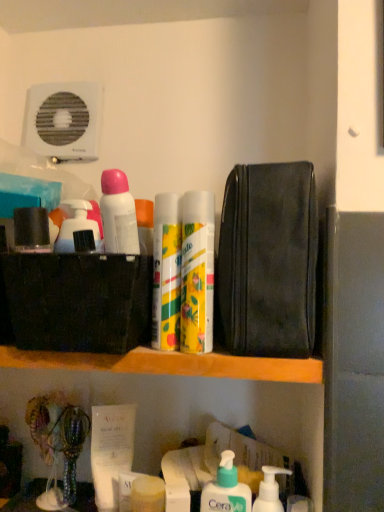
Question: In terms of size, does white pump bottle at lower center, the 5th toiletry when ordered from left to right, appear bigger or smaller than matte black container at upper left, which ranks as the 5th toiletry in right-to-left order?

Choices:
 (A) big
 (B) small

Answer: (A)

Question: From their relative heights in the image, would you say white pump bottle at lower center, which is the second toiletry from bottom to top, is taller or shorter than matte black container at upper left, the fourth toiletry in the bottom-to-top sequence?

Choices:
 (A) short
 (B) tall

Answer: (B)

Question: Which is nearer to the white pump bottle at lower center, the 1th toiletry viewed from the right?

Choices:
 (A) wooden shelf at center
 (B) white pump bottle at lower center, the 2th cleaning product from the top
 (C) yellow matte can at center, which is counted as the first cleaning product, starting from the top
 (D) white matte deodorant at upper left, placed as the 5th toiletry when sorted from bottom to top
 (E) matte black container at upper left, arranged as the first toiletry when viewed from the left

Answer: (B)

Question: Which is farther from the matte yellow soap at lower center, acting as the 3th toiletry starting from the left?

Choices:
 (A) black leather pouch at upper right
 (B) wooden shelf at center
 (C) white pump bottle at lower center, the 5th toiletry when ordered from left to right
 (D) yellow matte can at center, arranged as the second cleaning product when viewed from the right
 (E) white matte deodorant at upper left, marked as the fourth toiletry in a right-to-left arrangement

Answer: (E)